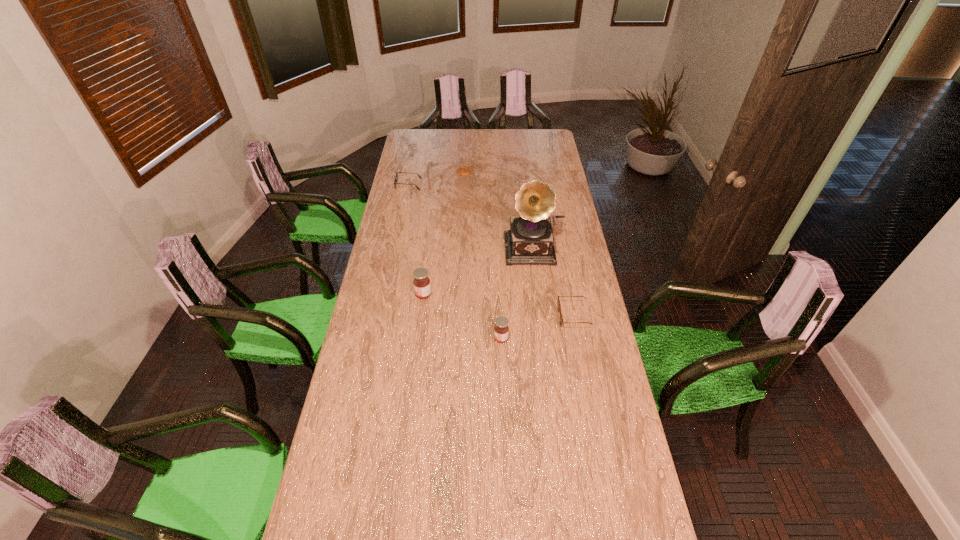
Where is `the third closest object to the fifth object from right to left`? The image size is (960, 540). the third closest object to the fifth object from right to left is located at coordinates (558, 301).